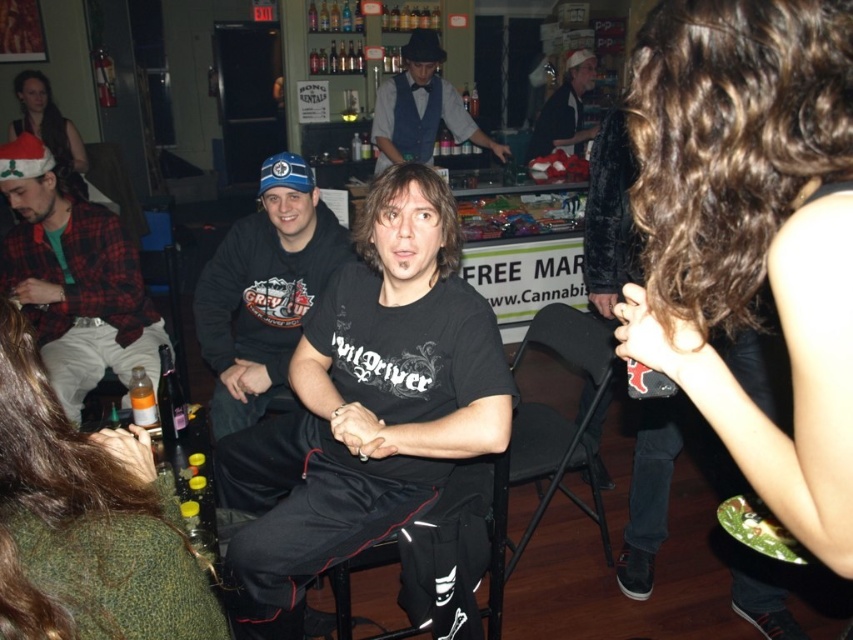
Does green woolen sweater at lower left come in front of matte black vest at center?

That is True.

Can you confirm if green woolen sweater at lower left is thinner than matte black vest at center?

Yes.

Is point (41, 497) farther from camera compared to point (428, 49)?

No, it is in front of (428, 49).

You are a GUI agent. You are given a task and a screenshot of the screen. Output one action in this format:
    pyautogui.click(x=<x>, y=<y>)
    Task: Click on the green woolen sweater at lower left
    The height and width of the screenshot is (640, 853).
    Given the screenshot: What is the action you would take?
    pyautogui.click(x=85, y=522)

Who is higher up, black matte shirt at center or matte black shirt at center?

matte black shirt at center is higher up.

Between point (239, 344) and point (549, 97), which one is positioned behind?

Point (549, 97)

Locate an element on the screen. The width and height of the screenshot is (853, 640). black matte shirt at center is located at coordinates (264, 289).

Does black matte t-shirt at center have a larger size compared to flannel shirt at left?

Correct, black matte t-shirt at center is larger in size than flannel shirt at left.

Which is in front, point (485, 317) or point (42, 321)?

Point (485, 317) is in front.

Image resolution: width=853 pixels, height=640 pixels. I want to click on black matte t-shirt at center, so click(x=364, y=406).